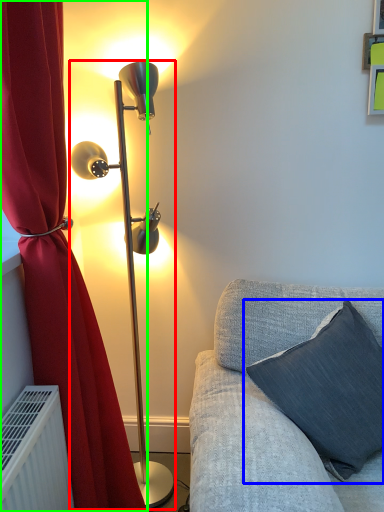
Question: Based on their relative distances, which object is nearer to lamp (highlighted by a red box)? Choose from pillow (highlighted by a blue box) and curtain (highlighted by a green box).

Choices:
 (A) pillow
 (B) curtain

Answer: (B)